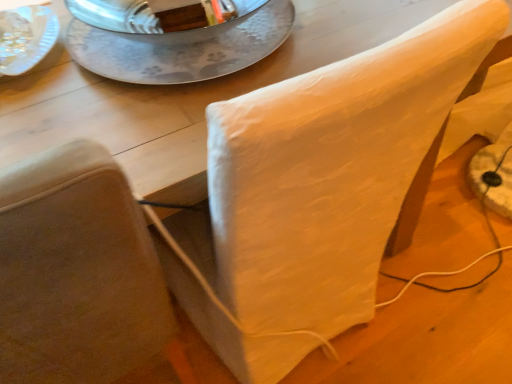
What do you see at coordinates (183, 47) in the screenshot?
I see `silver textured plate at upper center` at bounding box center [183, 47].

You are a GUI agent. You are given a task and a screenshot of the screen. Output one action in this format:
    pyautogui.click(x=<x>, y=<y>)
    Task: Click on the silver textured plate at upper center
    
    Given the screenshot: What is the action you would take?
    [x=183, y=47]

This screenshot has width=512, height=384. What do you see at coordinates (76, 272) in the screenshot? I see `white fabric chair at upper right` at bounding box center [76, 272].

Identify the location of white fabric chair at upper right. (76, 272).

I want to click on silver textured plate at upper center, so click(183, 47).

Is silver textured plate at upper center at the right side of white fabric chair at upper right?

Correct, you'll find silver textured plate at upper center to the right of white fabric chair at upper right.

Considering the relative positions of silver textured plate at upper center and white fabric chair at upper right in the image provided, is silver textured plate at upper center behind white fabric chair at upper right?

Yes.

Does point (87, 67) appear closer or farther from the camera than point (144, 285)?

Clearly, point (87, 67) is more distant from the camera than point (144, 285).

From the image's perspective, does silver textured plate at upper center appear lower than white fabric chair at upper right?

Incorrect, from the image's perspective, silver textured plate at upper center is higher than white fabric chair at upper right.

From a real-world perspective, which object stands above the other?

silver textured plate at upper center is physically above.

Considering the sizes of silver textured plate at upper center and white fabric chair at upper right in the image, is silver textured plate at upper center wider or thinner than white fabric chair at upper right?

Considering their sizes, silver textured plate at upper center looks slimmer than white fabric chair at upper right.

Consider the image. Can you confirm if silver textured plate at upper center is shorter than white fabric chair at upper right?

Correct, silver textured plate at upper center is not as tall as white fabric chair at upper right.

Who is smaller, silver textured plate at upper center or white fabric chair at upper right?

silver textured plate at upper center.

Based on the photo, is silver textured plate at upper center spatially inside white fabric chair at upper right, or outside of it?

silver textured plate at upper center is spatially situated outside white fabric chair at upper right.

Is silver textured plate at upper center next to white fabric chair at upper right and touching it?

No, silver textured plate at upper center is not in contact with white fabric chair at upper right.

Is silver textured plate at upper center looking in the opposite direction of white fabric chair at upper right?

No, silver textured plate at upper center's orientation is not away from white fabric chair at upper right.

How many degrees apart are the facing directions of silver textured plate at upper center and white fabric chair at upper right?

The facing directions of silver textured plate at upper center and white fabric chair at upper right are 4.41 degrees apart.

Locate an element on the screen. glass plate that appears above the white fabric chair at upper right (from the image's perspective) is located at coordinates (183, 47).

Does white fabric chair at upper right appear on the left side of silver textured plate at upper center?

Indeed, white fabric chair at upper right is positioned on the left side of silver textured plate at upper center.

Relative to silver textured plate at upper center, is white fabric chair at upper right in front or behind?

Visually, white fabric chair at upper right is located in front of silver textured plate at upper center.

Which is in front, point (14, 210) or point (159, 67)?

The point (14, 210) is more forward.

From the image's perspective, which object appears higher, white fabric chair at upper right or silver textured plate at upper center?

silver textured plate at upper center appears higher in the image.

From a real-world perspective, is white fabric chair at upper right on top of silver textured plate at upper center?

No, from a real-world perspective, white fabric chair at upper right is not above silver textured plate at upper center.

In terms of width, does white fabric chair at upper right look wider or thinner when compared to silver textured plate at upper center?

Considering their sizes, white fabric chair at upper right looks broader than silver textured plate at upper center.

Considering the relative sizes of white fabric chair at upper right and silver textured plate at upper center in the image provided, is white fabric chair at upper right taller than silver textured plate at upper center?

Yes.

Does white fabric chair at upper right have a larger size compared to silver textured plate at upper center?

Yes.

Is white fabric chair at upper right situated inside silver textured plate at upper center or outside?

white fabric chair at upper right is located beyond the bounds of silver textured plate at upper center.

Is white fabric chair at upper right next to silver textured plate at upper center and touching it?

No, white fabric chair at upper right is not in contact with silver textured plate at upper center.

Is silver textured plate at upper center at the back of white fabric chair at upper right?

That's not correct — white fabric chair at upper right is not looking away from silver textured plate at upper center.

How different are the orientations of white fabric chair at upper right and silver textured plate at upper center in degrees?

There is a 4.41-degree angle between the facing directions of white fabric chair at upper right and silver textured plate at upper center.

You are a GUI agent. You are given a task and a screenshot of the screen. Output one action in this format:
    pyautogui.click(x=<x>, y=<y>)
    Task: Click on the chair that appears on the left of silver textured plate at upper center
    This screenshot has width=512, height=384.
    Given the screenshot: What is the action you would take?
    pyautogui.click(x=76, y=272)

The width and height of the screenshot is (512, 384). Find the location of `glass plate above the white fabric chair at upper right (from a real-world perspective)`. glass plate above the white fabric chair at upper right (from a real-world perspective) is located at coordinates (183, 47).

Image resolution: width=512 pixels, height=384 pixels. What are the coordinates of `glass plate on the right of white fabric chair at upper right` in the screenshot? It's located at (183, 47).